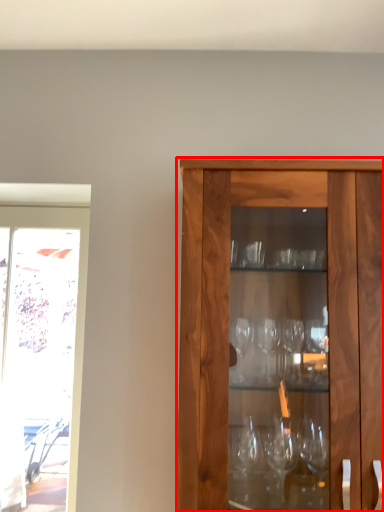
Question: From the image's perspective, considering the relative positions of cabinetry (annotated by the red box) and screen door in the image provided, where is cabinetry (annotated by the red box) located with respect to the staircase?

Choices:
 (A) above
 (B) below

Answer: (A)